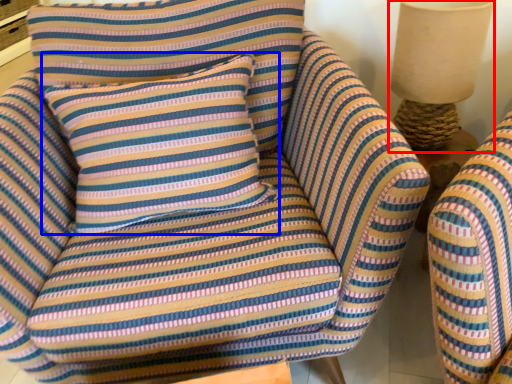
Question: Which object appears closest to the camera in this image, table lamp (highlighted by a red box) or pillow (highlighted by a blue box)?

Choices:
 (A) table lamp
 (B) pillow

Answer: (B)